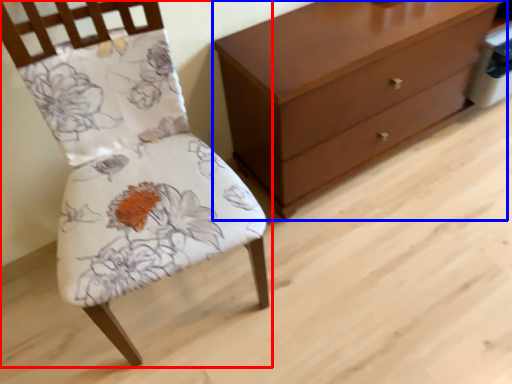
Question: Which object is further to the camera taking this photo, chair (highlighted by a red box) or chest of drawers (highlighted by a blue box)?

Choices:
 (A) chair
 (B) chest of drawers

Answer: (B)